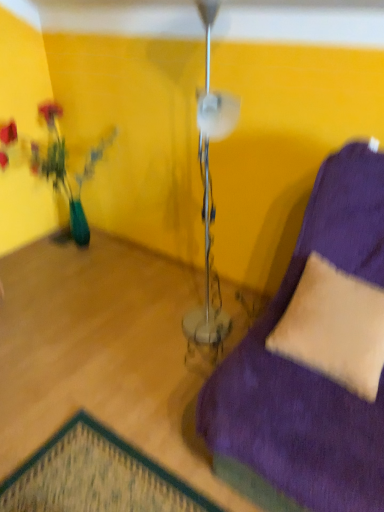
Question: Does point (56, 128) appear closer or farther from the camera than point (347, 320)?

Choices:
 (A) closer
 (B) farther

Answer: (B)

Question: Considering the positions of teal glass vase at left and beige suede pillow at lower right in the image, is teal glass vase at left wider or thinner than beige suede pillow at lower right?

Choices:
 (A) thin
 (B) wide

Answer: (B)

Question: Is teal glass vase at left situated inside beige suede pillow at lower right or outside?

Choices:
 (A) outside
 (B) inside

Answer: (A)

Question: In terms of width, does beige suede pillow at lower right look wider or thinner when compared to teal glass vase at left?

Choices:
 (A) wide
 (B) thin

Answer: (B)

Question: Considering their positions, is beige suede pillow at lower right located in front of or behind teal glass vase at left?

Choices:
 (A) behind
 (B) front

Answer: (B)

Question: Looking at the image, does beige suede pillow at lower right seem bigger or smaller compared to teal glass vase at left?

Choices:
 (A) big
 (B) small

Answer: (B)

Question: From the image's perspective, relative to teal glass vase at left, is beige suede pillow at lower right above or below?

Choices:
 (A) below
 (B) above

Answer: (A)